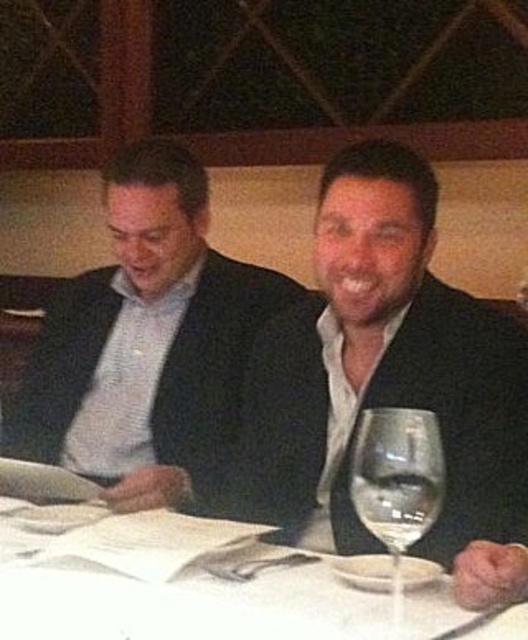
I want to click on matte black suit at center, so click(x=146, y=342).

Which is behind, point (109, 440) or point (431, 452)?

The point (109, 440) is behind.

Which is in front, point (208, 419) or point (393, 598)?

Point (393, 598)

Identify the location of matte black suit at center. Image resolution: width=528 pixels, height=640 pixels. (146, 342).

The width and height of the screenshot is (528, 640). Identify the location of white paper at center. (163, 580).

Can you confirm if white paper at center is thinner than clear glass wine glass at center?

No.

Between point (63, 557) and point (394, 580), which one is positioned in front?

Positioned in front is point (394, 580).

In order to click on white paper at center in this screenshot , I will do `click(163, 580)`.

Who is shorter, black matte suit at center or clear glass wine glass at center?

clear glass wine glass at center

Can you confirm if black matte suit at center is positioned to the left of clear glass wine glass at center?

Correct, you'll find black matte suit at center to the left of clear glass wine glass at center.

You are a GUI agent. You are given a task and a screenshot of the screen. Output one action in this format:
    pyautogui.click(x=<x>, y=<y>)
    Task: Click on the black matte suit at center
    
    Given the screenshot: What is the action you would take?
    pyautogui.click(x=361, y=378)